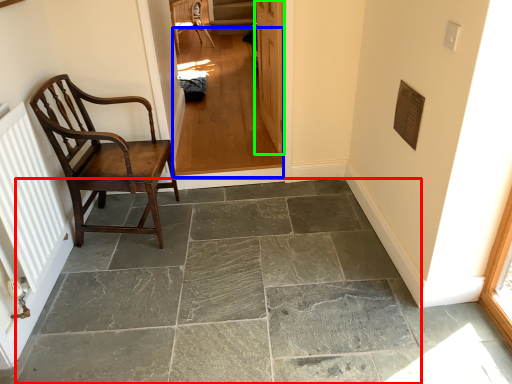
Question: Which object is the closest to the concrete (highlighted by a red box)? Choose among these: corridor (highlighted by a blue box) or door (highlighted by a green box).

Choices:
 (A) corridor
 (B) door

Answer: (A)